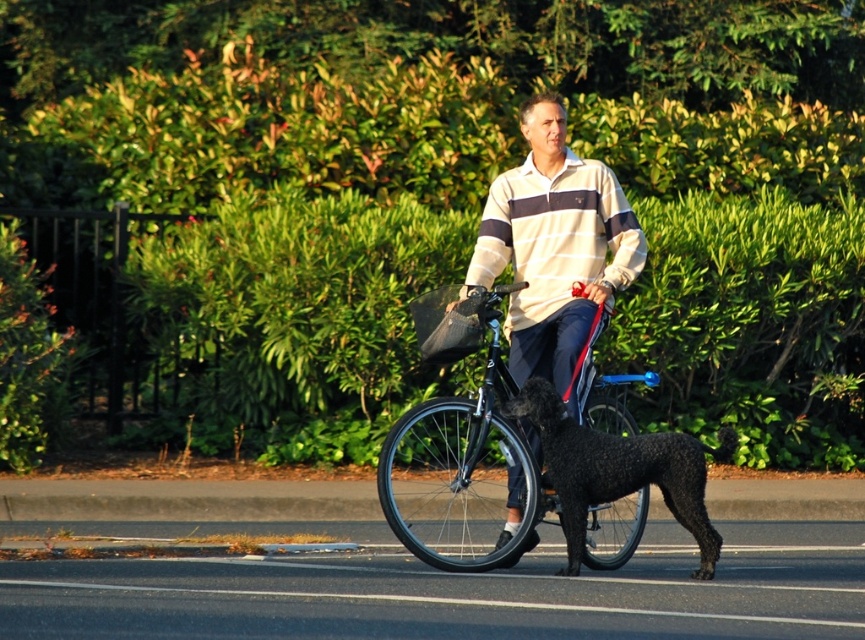
You are a delivery person who needs to place a package on the shiny black bicycle at center. The delivery area is a grid with coordinates from 0 to 1 in both x and y directions. What are the coordinates where you should place the package?

The coordinates for the shiny black bicycle at center are at point (457, 444), so you should place the package at those coordinates.

You are a pedestrian standing on the sidewalk observing a scene. You see a shiny black bicycle at center and a striped cotton shirt at center. Which object is taller?

The striped cotton shirt at center is taller than the shiny black bicycle at center.